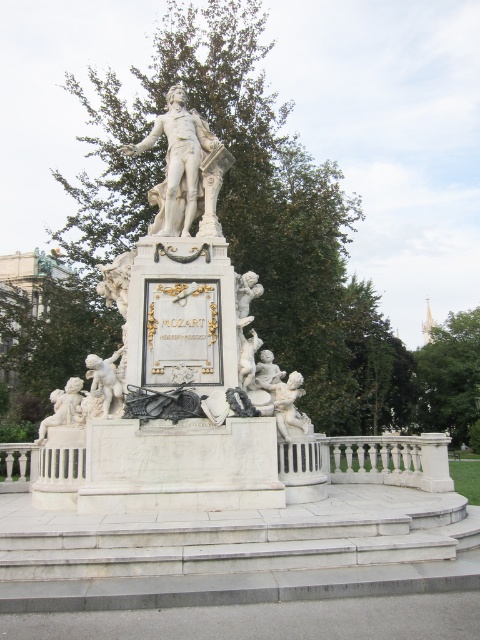
Does point (54, 394) come closer to viewer compared to point (120, 353)?

No, it is behind (120, 353).

Who is more forward, (55, 400) or (111, 384)?

Point (111, 384) is in front.

Does point (60, 401) come closer to viewer compared to point (95, 372)?

No.

This screenshot has width=480, height=640. What are the coordinates of `white marble cherub at lower left` in the screenshot? It's located at (62, 406).

Between point (178, 214) and point (96, 388), which one is positioned behind?

The point (178, 214) is more distant.

Who is positioned more to the left, white marble statue at center or matte white cherub at lower left?

white marble statue at center

Where is `white marble statue at center`? The width and height of the screenshot is (480, 640). white marble statue at center is located at coordinates point(184,170).

This screenshot has height=640, width=480. Identify the location of white marble statue at center. pos(184,170).

Can you confirm if white marble railing at center is bigger than matte white cherub at lower left?

Yes, white marble railing at center is bigger than matte white cherub at lower left.

Does point (9, 492) come farther from viewer compared to point (108, 371)?

That is True.

Identify the location of white marble railing at center. pyautogui.click(x=387, y=460).